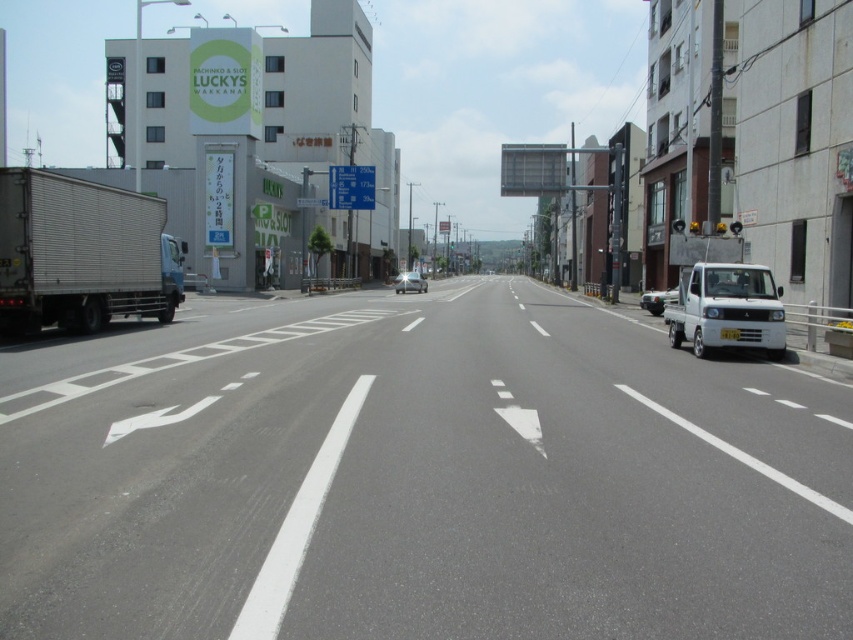
Who is positioned more to the left, white matte truck at left or shiny silver car at center?

Positioned to the left is shiny silver car at center.

Does white matte truck at left have a smaller size compared to shiny silver car at center?

Incorrect, white matte truck at left is not smaller in size than shiny silver car at center.

Is point (431, 540) positioned after point (409, 285)?

No.

Find the location of a particular element. white matte truck at left is located at coordinates (416, 476).

Does white matte truck at left have a lesser width compared to white matte truck at right?

Incorrect, white matte truck at left's width is not less than white matte truck at right's.

Between white matte truck at left and white matte truck at right, which one appears on the right side from the viewer's perspective?

Positioned to the right is white matte truck at right.

Is point (613, 394) positioned before point (741, 285)?

Yes.

At what (x,y) coordinates should I click in order to perform the action: click on white matte truck at left. Please return your answer as a coordinate pair (x, y). This screenshot has width=853, height=640. Looking at the image, I should click on (416, 476).

The width and height of the screenshot is (853, 640). What do you see at coordinates (82, 253) in the screenshot?
I see `silver textured truck at left` at bounding box center [82, 253].

Who is lower down, silver textured truck at left or white matte truck at right?

white matte truck at right

Identify the location of silver textured truck at left. This screenshot has height=640, width=853. (82, 253).